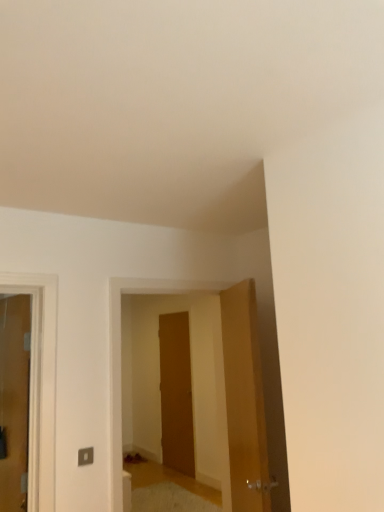
Question: Does matte wooden door at left, positioned as the 1th door in left-to-right order, have a lesser height compared to wooden door at center, which is the 3th door from front to back?

Choices:
 (A) no
 (B) yes

Answer: (B)

Question: Is matte wooden door at left, positioned as the 1th door in left-to-right order, behind wooden door at center, which is the 3th door from front to back?

Choices:
 (A) yes
 (B) no

Answer: (B)

Question: Is matte wooden door at left, positioned as the 1th door in left-to-right order, outside of wooden door at center, positioned as the second door in left-to-right order?

Choices:
 (A) no
 (B) yes

Answer: (B)

Question: Is matte wooden door at left, which is the third door in right-to-left order, to the right of wooden door at center, the 1th door positioned from the back, from the viewer's perspective?

Choices:
 (A) no
 (B) yes

Answer: (A)

Question: Is matte wooden door at left, the second door positioned from the back, taller than wooden door at center, positioned as the second door in left-to-right order?

Choices:
 (A) yes
 (B) no

Answer: (B)

Question: In terms of size, does matte wooden door at left, which is the third door in right-to-left order, appear bigger or smaller than wooden door at center, the 2th door when ordered from right to left?

Choices:
 (A) small
 (B) big

Answer: (B)

Question: Is matte wooden door at left, which is the third door in right-to-left order, to the left or to the right of wooden door at center, the 2th door when ordered from right to left, in the image?

Choices:
 (A) left
 (B) right

Answer: (A)

Question: In terms of height, does matte wooden door at left, positioned as the 1th door in left-to-right order, look taller or shorter compared to wooden door at center, the 1th door positioned from the back?

Choices:
 (A) short
 (B) tall

Answer: (A)

Question: From the image's perspective, is matte wooden door at left, which is the third door in right-to-left order, positioned above or below wooden door at center, the 2th door when ordered from right to left?

Choices:
 (A) above
 (B) below

Answer: (A)

Question: From the image's perspective, relative to matte wooden door at left, which is the third door in right-to-left order, is wooden door at center, which is the 3th door from front to back, above or below?

Choices:
 (A) above
 (B) below

Answer: (B)

Question: Considering the relative positions of wooden door at center, positioned as the second door in left-to-right order, and matte wooden door at left, positioned as the 1th door in left-to-right order, in the image provided, is wooden door at center, positioned as the second door in left-to-right order, to the left or to the right of matte wooden door at left, positioned as the 1th door in left-to-right order,?

Choices:
 (A) right
 (B) left

Answer: (A)

Question: Is wooden door at center, which is the 3th door from front to back, in front of or behind matte wooden door at left, positioned as the 1th door in left-to-right order, in the image?

Choices:
 (A) behind
 (B) front

Answer: (A)

Question: Is wooden door at center, which is the 3th door from front to back, wider or thinner than matte wooden door at left, which is the third door in right-to-left order?

Choices:
 (A) thin
 (B) wide

Answer: (A)

Question: Based on their sizes in the image, would you say wooden door at center is bigger or smaller than wooden door at right, which is counted as the 3th door, starting from the back?

Choices:
 (A) small
 (B) big

Answer: (B)

Question: Is point (117, 355) closer or farther from the camera than point (253, 460)?

Choices:
 (A) closer
 (B) farther

Answer: (A)